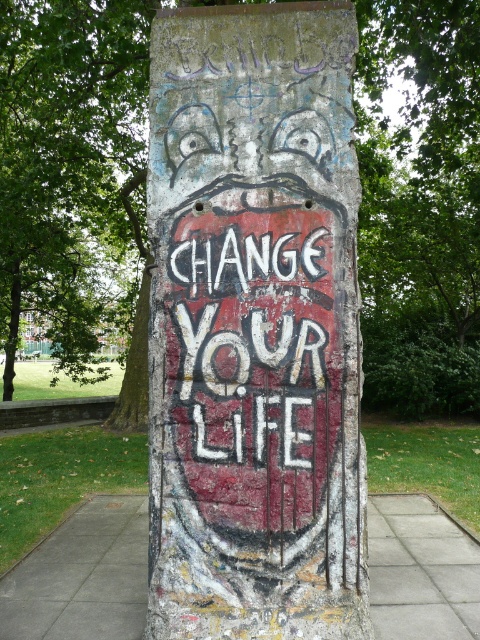
You are standing in front of the Berlin Wall section described. You notice a grungy concrete pillar at center. Where exactly is this pillar positioned relative to the wall?

The grungy concrete pillar at center is located at point coordinates of approximately 0.512 on the x and 0.531 on the y axis, meaning it is centrally positioned on the wall.

You are a tourist in Berlin standing in front of the Berlin Wall. You see the grungy concrete pillar at center and the white chalk text at center. Which object is taller?

The grungy concrete pillar at center is much taller than the white chalk text at center.